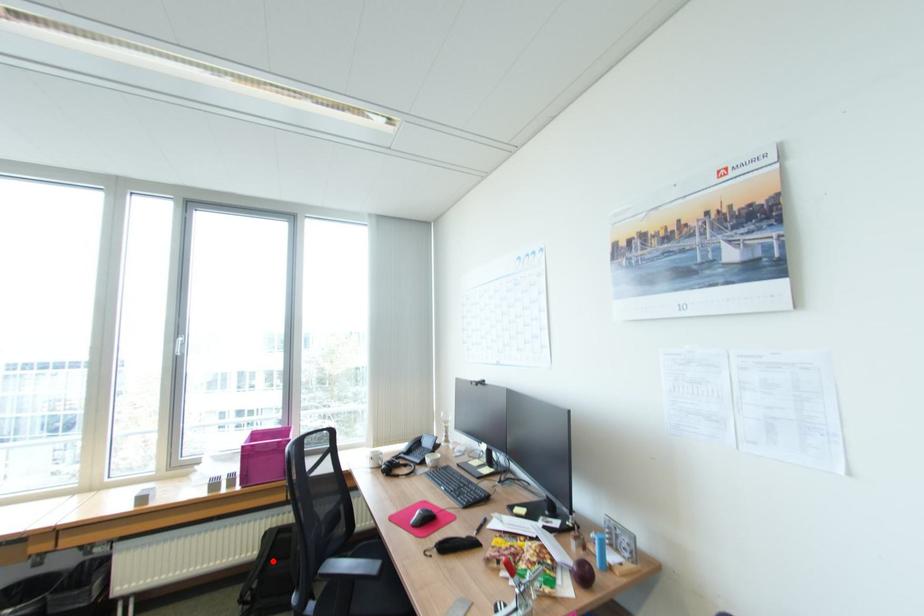
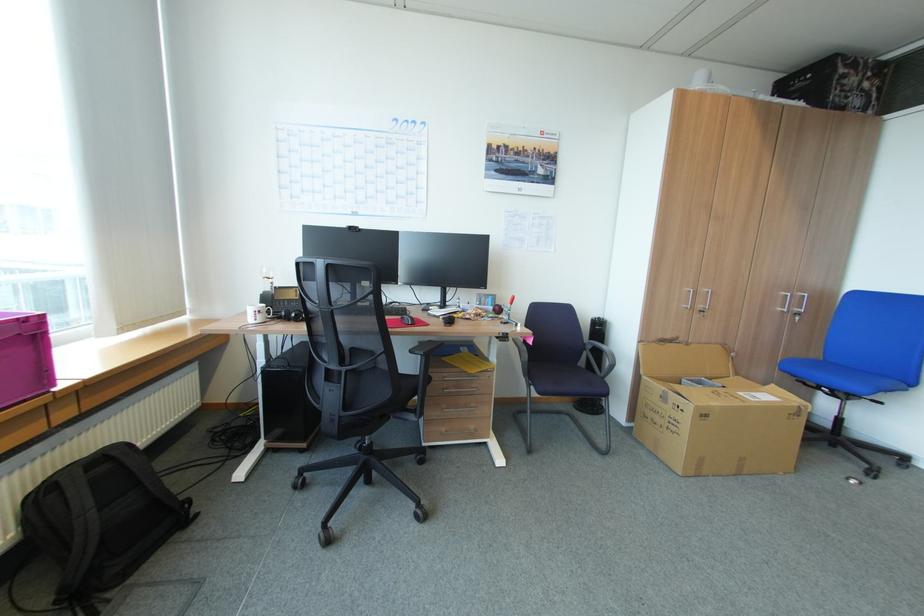
Where in the second image is the point corresponding to the highlighted location from the first image?

(103, 511)